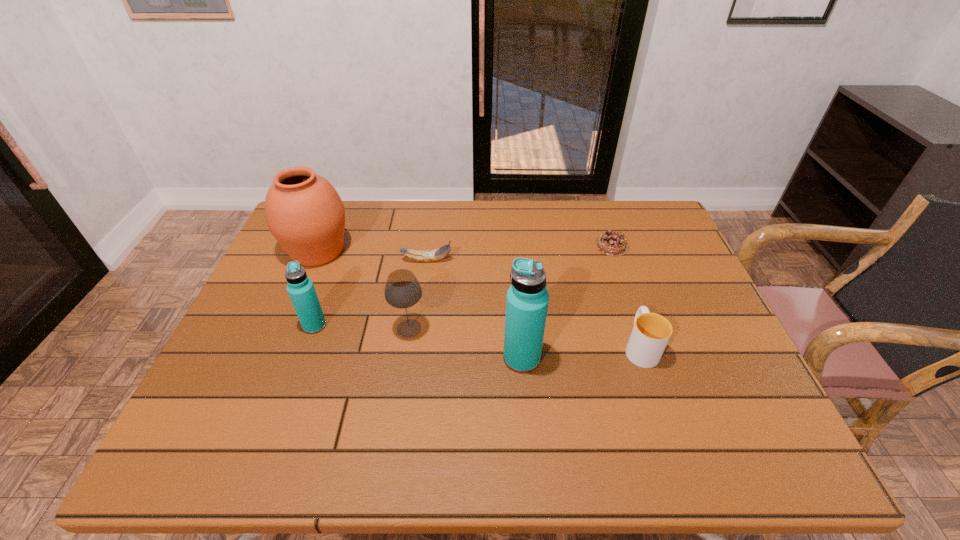
Locate an element on the screen. The height and width of the screenshot is (540, 960). vacant region located 0.210m on the right of the taller water bottle is located at coordinates [628, 358].

This screenshot has height=540, width=960. Identify the location of free space located at the stem of the sixth tallest object. (496, 260).

You are a GUI agent. You are given a task and a screenshot of the screen. Output one action in this format:
    pyautogui.click(x=<x>, y=<y>)
    Task: Click on the vacant region located 0.060m on the left of the shortest object
    
    Given the screenshot: What is the action you would take?
    pyautogui.click(x=576, y=246)

Where is `vacant space located 0.090m on the back of the second tallest object`? vacant space located 0.090m on the back of the second tallest object is located at coordinates (333, 213).

The width and height of the screenshot is (960, 540). In order to click on vacant space situated 0.270m with the handle on the side of the third shortest object in this screenshot , I will do `click(612, 259)`.

Find the location of a particular element. The width and height of the screenshot is (960, 540). vacant position located with the handle on the side of the third shortest object is located at coordinates (605, 240).

The width and height of the screenshot is (960, 540). I want to click on blank space located 0.350m with the handle on the side of the third shortest object, so click(x=606, y=242).

I want to click on vacant space located on the right of the wineglass, so click(x=513, y=328).

Where is `chocolate cake located at the far edge`? The width and height of the screenshot is (960, 540). chocolate cake located at the far edge is located at coordinates (610, 243).

Find the location of `urn located in the far edge section of the desktop`. urn located in the far edge section of the desktop is located at coordinates (303, 211).